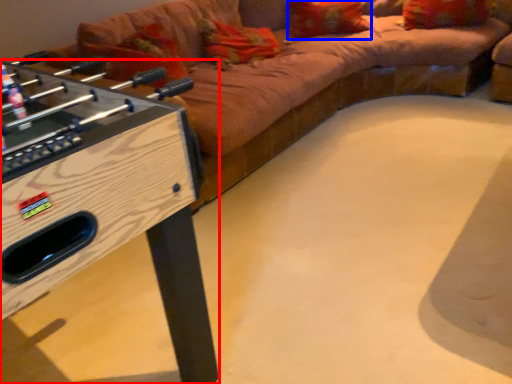
Question: Which object is closer to the camera taking this photo, furniture (highlighted by a red box) or pillow (highlighted by a blue box)?

Choices:
 (A) furniture
 (B) pillow

Answer: (A)